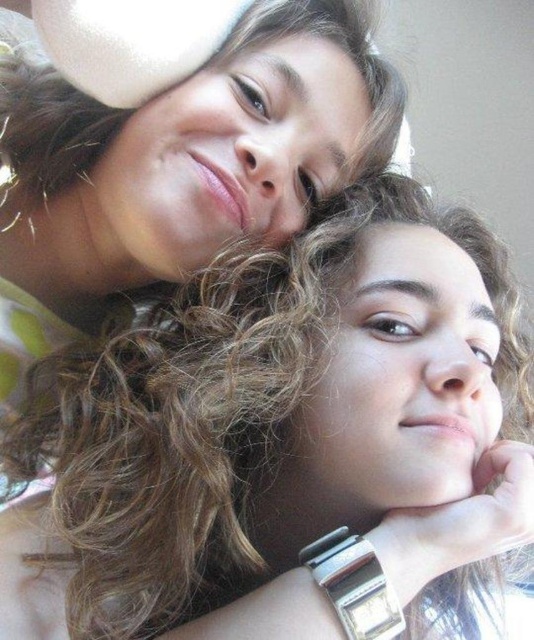
Does point (365, 484) come in front of point (380, 618)?

No, (365, 484) is further to viewer.

Can you confirm if curly hair at center is shorter than silver metallic watch at lower center?

No, curly hair at center is not shorter than silver metallic watch at lower center.

The width and height of the screenshot is (534, 640). What do you see at coordinates (285, 440) in the screenshot?
I see `curly hair at center` at bounding box center [285, 440].

Where is `curly hair at center`? curly hair at center is located at coordinates click(x=285, y=440).